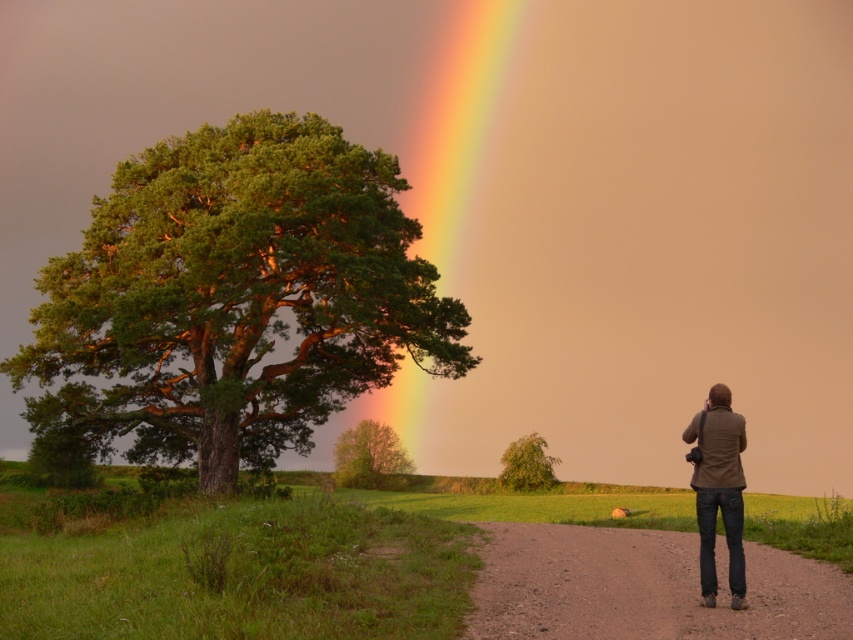
Question: Can you confirm if green textured tree at left is positioned to the right of dirt/gravel path at lower center?

Choices:
 (A) no
 (B) yes

Answer: (A)

Question: Which object appears farthest from the camera in this image?

Choices:
 (A) brown leather jacket at lower right
 (B) green textured tree at left
 (C) dirt/gravel path at lower center
 (D) rainbow at upper center

Answer: (D)

Question: Which of these objects is positioned farthest from the green matte tree at center?

Choices:
 (A) green leafy tree at center
 (B) brown leather jacket at lower right
 (C) rainbow at upper center
 (D) green textured tree at left

Answer: (B)

Question: Does green leafy tree at center have a smaller size compared to green matte tree at center?

Choices:
 (A) no
 (B) yes

Answer: (A)

Question: Which of the following is the farthest from the observer?

Choices:
 (A) (428, 160)
 (B) (387, 460)

Answer: (A)

Question: Can you confirm if rainbow at upper center is smaller than brown leather jacket at lower right?

Choices:
 (A) no
 (B) yes

Answer: (A)